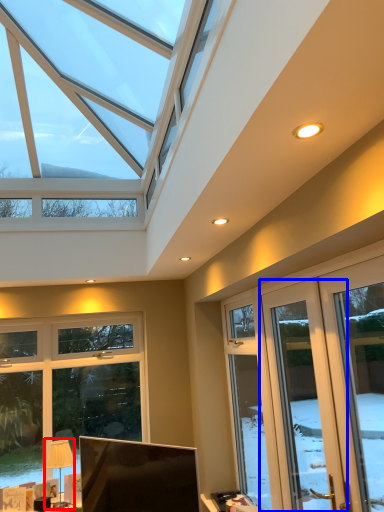
Question: Which point is closer to the camera, table lamp (highlighted by a red box) or screen door (highlighted by a blue box)?

Choices:
 (A) table lamp
 (B) screen door

Answer: (B)